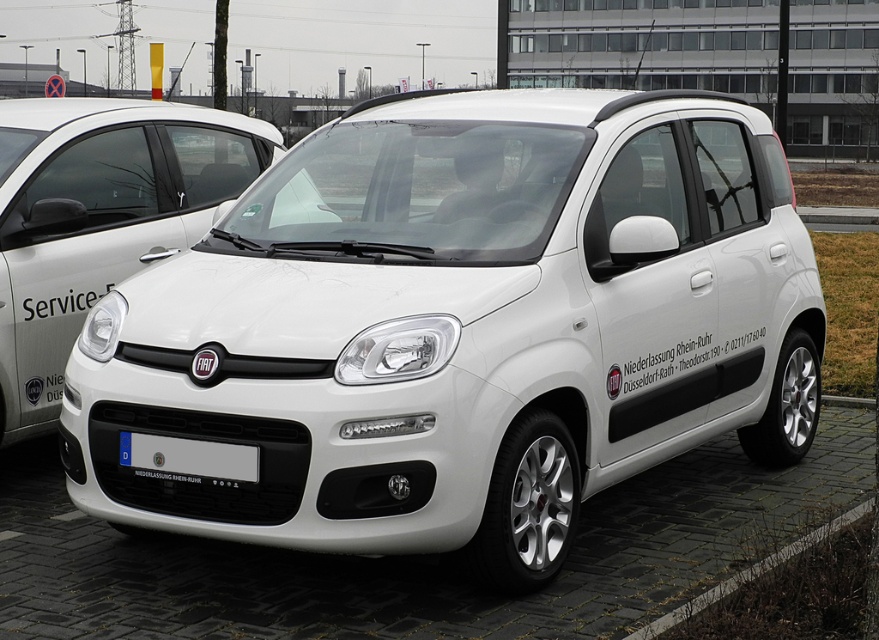
Does white matte car at center appear on the right side of gray concrete curb at lower right?

In fact, white matte car at center is to the left of gray concrete curb at lower right.

Between point (587, 220) and point (838, 518), which one is positioned in front?

Point (587, 220) is in front.

Between point (766, 115) and point (754, 573), which one is positioned in front?

Point (754, 573)

The width and height of the screenshot is (879, 640). Find the location of `white matte car at center`. white matte car at center is located at coordinates click(461, 326).

Is white matte fiat car at center closer to camera compared to gray concrete curb at lower right?

No.

This screenshot has height=640, width=879. Describe the element at coordinates (98, 218) in the screenshot. I see `white matte fiat car at center` at that location.

Find the location of `white matte fiat car at center`. white matte fiat car at center is located at coordinates (98, 218).

Is point (691, 362) behind point (231, 468)?

Yes, point (691, 362) is behind point (231, 468).

What are the coordinates of `white matte car at center` in the screenshot? It's located at (461, 326).